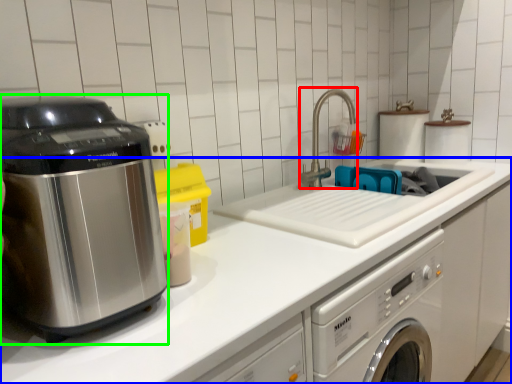
Question: Which object is the closest to the faucet (highlighted by a red box)? Choose among these: countertop (highlighted by a blue box) or home appliance (highlighted by a green box).

Choices:
 (A) countertop
 (B) home appliance

Answer: (A)